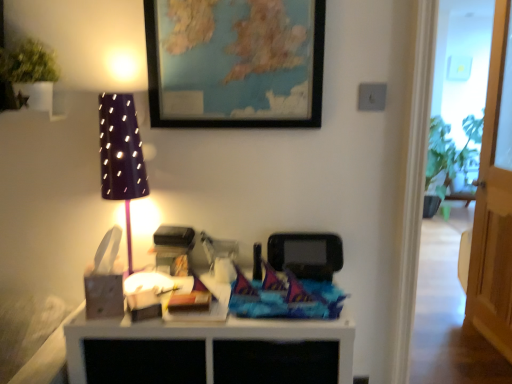
Question: Is point (485, 198) closer or farther from the camera than point (230, 327)?

Choices:
 (A) farther
 (B) closer

Answer: (A)

Question: Considering their positions, is transparent wooden door at right located in front of or behind wooden table at center?

Choices:
 (A) front
 (B) behind

Answer: (B)

Question: Estimate the real-world distances between objects in this image. Which object is farther from the green matte plant at upper left?

Choices:
 (A) matte black picture frame at upper center
 (B) transparent wooden door at right
 (C) wooden table at center
 (D) matte black lampshade at left

Answer: (B)

Question: Based on their relative distances, which object is farther from the matte black lampshade at left?

Choices:
 (A) matte black picture frame at upper center
 (B) wooden table at center
 (C) transparent wooden door at right
 (D) green matte plant at upper left

Answer: (C)